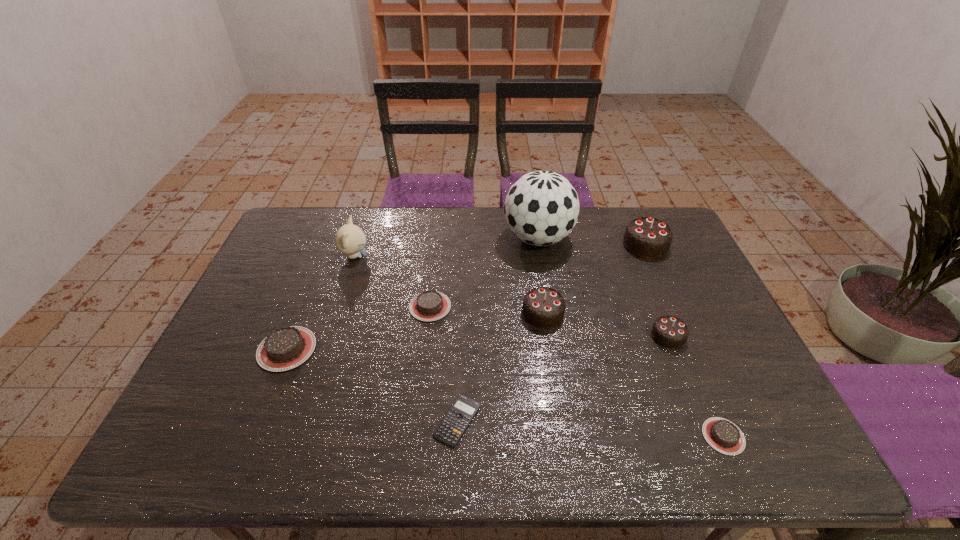
Locate an element on the screen. the leftmost chocolate cake is located at coordinates (285, 348).

Locate an element on the screen. The image size is (960, 540). the second chocolate cake from left to right is located at coordinates (430, 305).

Locate an element on the screen. The image size is (960, 540). the second brown chocolate cake from left to right is located at coordinates (430, 305).

Where is `the eighth tallest object`? Image resolution: width=960 pixels, height=540 pixels. the eighth tallest object is located at coordinates (724, 436).

Where is `the rightmost brown chocolate cake`? the rightmost brown chocolate cake is located at coordinates (724, 436).

At what (x,y) coordinates should I click in order to perform the action: click on calculator. Please return your answer as a coordinate pair (x, y). The width and height of the screenshot is (960, 540). Looking at the image, I should click on (449, 431).

Locate an element on the screen. The height and width of the screenshot is (540, 960). vacant space located 0.300m on the right of the soccer ball is located at coordinates (661, 239).

Locate an element on the screen. vacant space located 0.080m on the face of the kitten is located at coordinates (394, 256).

Where is `free point located 0.330m on the left of the biggest chocolate chocolate cake`? free point located 0.330m on the left of the biggest chocolate chocolate cake is located at coordinates (525, 245).

Locate an element on the screen. The height and width of the screenshot is (540, 960). free region located on the left of the second smallest chocolate chocolate cake is located at coordinates (501, 313).